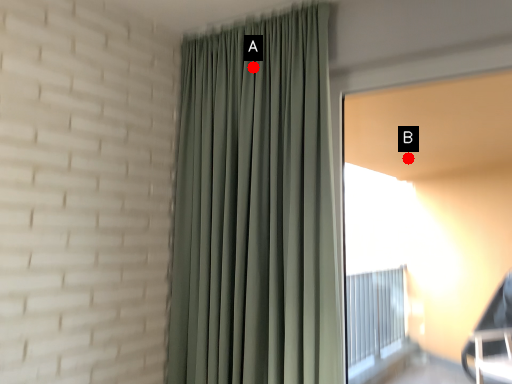
Question: Two points are circled on the image, labeled by A and B beside each circle. Which of the following is the closest to the observer?

Choices:
 (A) A is closer
 (B) B is closer

Answer: (A)